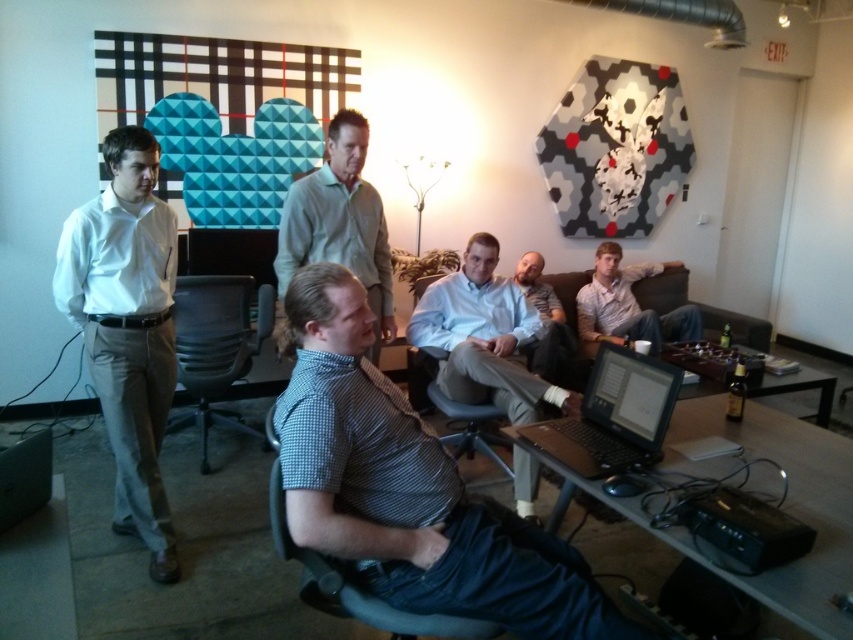
Question: Does white smooth shirt at left appear under black plastic laptop at center?

Choices:
 (A) yes
 (B) no

Answer: (B)

Question: Considering the real-world distances, which object is closest to the checkered shirt at center?

Choices:
 (A) light brown shirt at center
 (B) checkered fabric shirt at center
 (C) white smooth shirt at left
 (D) black plastic laptop at center

Answer: (D)

Question: Does checkered fabric shirt at center have a smaller size compared to black mesh swivel chair at center?

Choices:
 (A) yes
 (B) no

Answer: (A)

Question: Based on their relative distances, which object is nearer to the light brown shirt at center?

Choices:
 (A) light gray shirt at center
 (B) checkered shirt at center

Answer: (B)

Question: Among these objects, which one is farthest from the camera?

Choices:
 (A) checkered shirt at center
 (B) black mesh swivel chair at center

Answer: (B)

Question: Can you confirm if white smooth shirt at left is positioned to the right of light blue shirt at center?

Choices:
 (A) yes
 (B) no

Answer: (B)